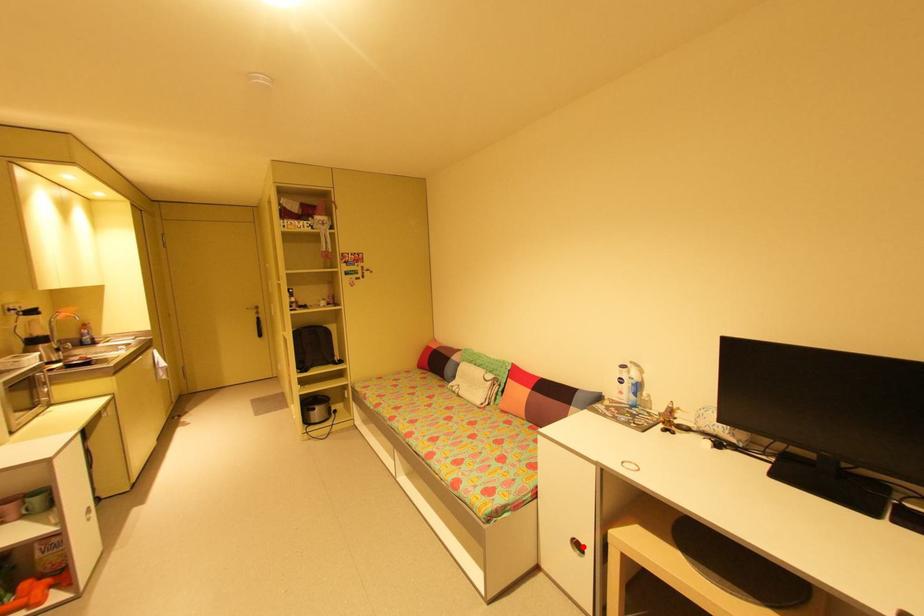
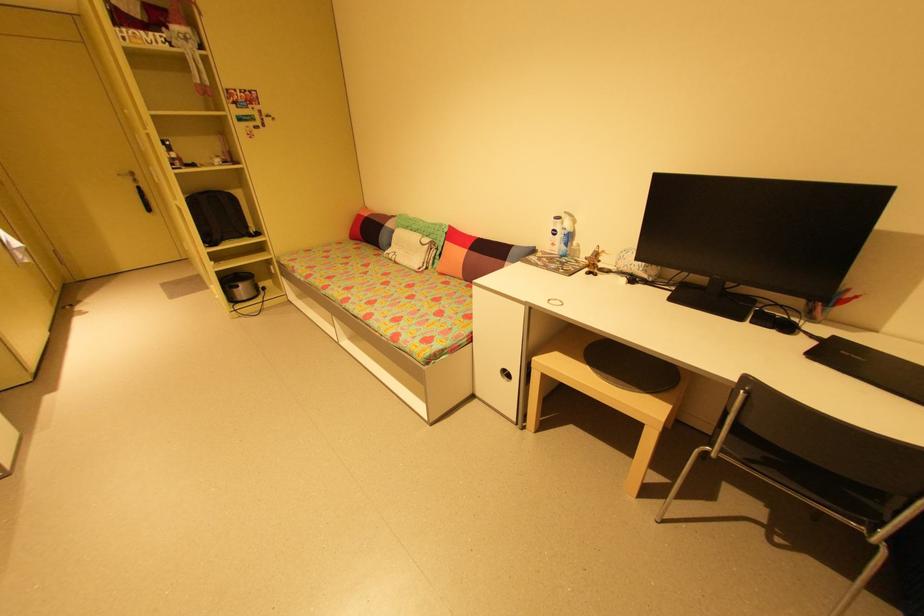
Locate, in the second image, the point that corresponds to the highlighted location in the first image.

(512, 375)